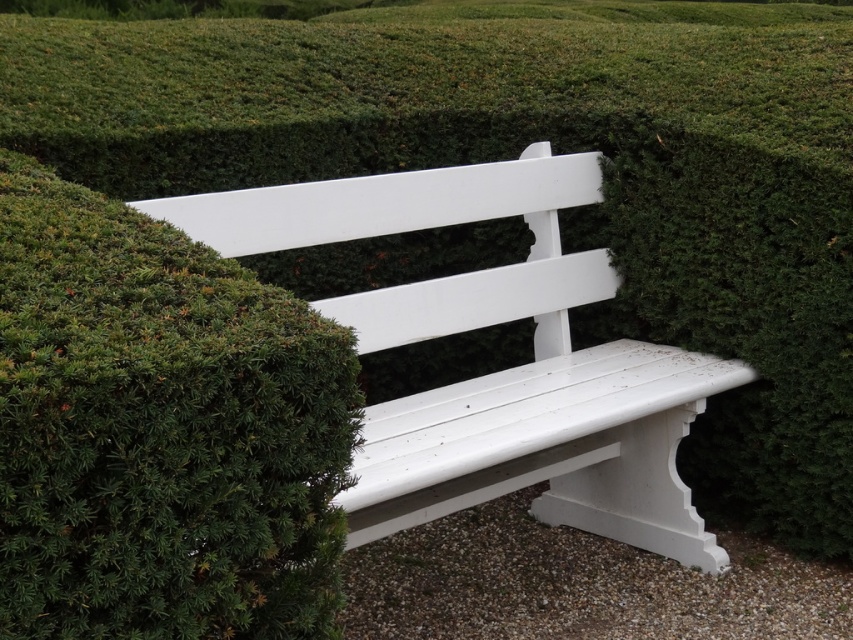
You are designing a garden layout and need to ensure that the green textured shrub at upper left and the white painted wood bench at center are visible from the main pathway. Given their heights, which object might block the view of the other if placed directly in front?

The white painted wood bench at center is taller than the green textured shrub at upper left, so if placed directly in front, it could block the view of the shrub.

You are sitting on the white painted wood bench at center and want to look at the green textured shrub at upper left. Which direction should you turn your head to see it?

You should turn your head to the upper left to see the green textured shrub at upper left since it is closer to the viewer than the white painted wood bench at center.

You are standing at the center of the image and want to find the green textured shrub at upper left. According to the coordinates given, in which direction should you look to locate it?

The green textured shrub at upper left is located at coordinates point (160, 429), so you should look to the upper left direction to find it.